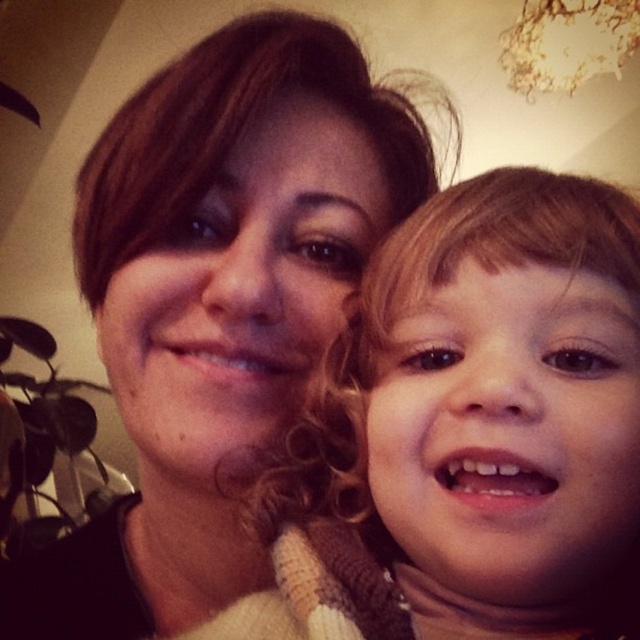
Measure the distance between smooth beige sweater at center and camera.

A distance of 11.31 inches exists between smooth beige sweater at center and camera.

Does smooth beige sweater at center come behind matte brown hair at center?

No, it is in front of matte brown hair at center.

Is point (486, 573) positioned behind point (198, 83)?

No, it is not.

This screenshot has width=640, height=640. Find the location of `smooth beige sweater at center`. smooth beige sweater at center is located at coordinates (472, 432).